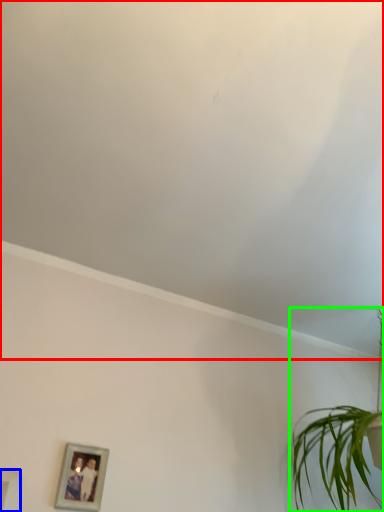
Question: Which is farther away from cloud (highlighted by a red box)? picture frame (highlighted by a blue box) or houseplant (highlighted by a green box)?

Choices:
 (A) picture frame
 (B) houseplant

Answer: (A)